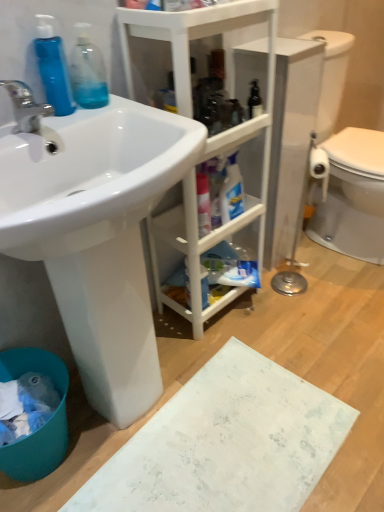
The image size is (384, 512). In order to click on vacant area that is in front of blue plastic bottle at left, the first cleaning product when ordered from left to right in this screenshot , I will do `click(44, 125)`.